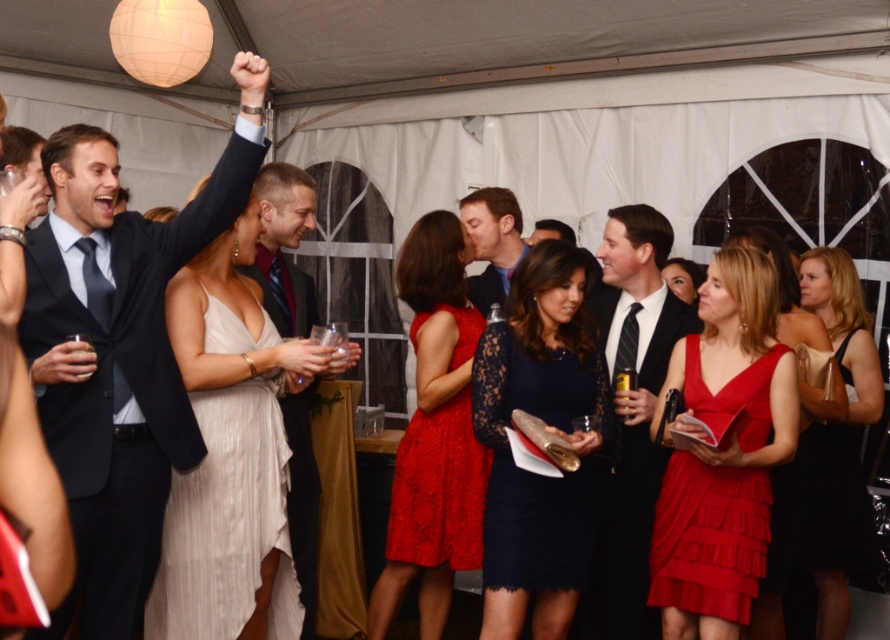
Question: Which point is farther to the camera?

Choices:
 (A) black lace dress at right
 (B) satin beige dress at center
 (C) black satin dress at center

Answer: (C)

Question: Where is matte black suit at center located in relation to shiny dark suit at center in the image?

Choices:
 (A) left
 (B) right

Answer: (A)

Question: Is matte black suit at center further to camera compared to matte blue suit at center?

Choices:
 (A) no
 (B) yes

Answer: (A)

Question: Which of the following is the closest to the observer?

Choices:
 (A) shiny dark suit at center
 (B) satin beige dress at center
 (C) black lace dress at right
 (D) ruffled red dress at center

Answer: (B)

Question: Considering the real-world distances, which object is closest to the lace dress at center?

Choices:
 (A) matte black suit at center
 (B) ruffled red dress at center
 (C) matte red dress at center

Answer: (C)

Question: Is matte black suit at center below matte red dress at center?

Choices:
 (A) yes
 (B) no

Answer: (B)